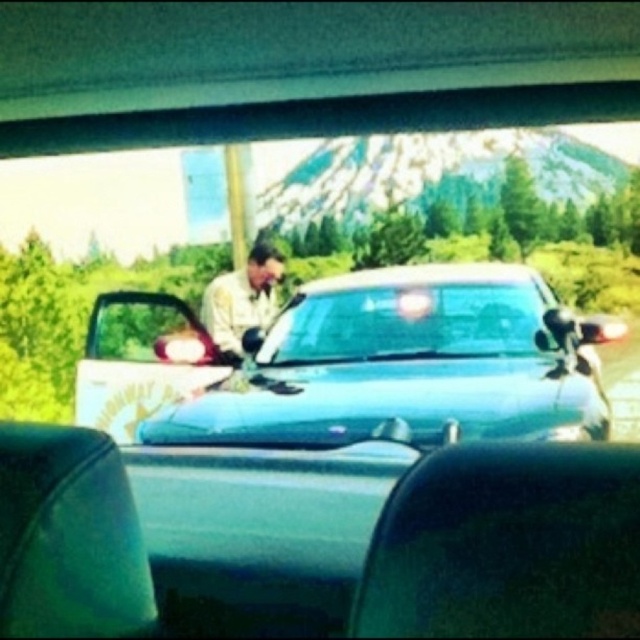
Between matte khaki uniform at center and light beige uniform at center, which one has less height?

Standing shorter between the two is light beige uniform at center.

Can you confirm if matte khaki uniform at center is positioned to the right of light beige uniform at center?

Yes, matte khaki uniform at center is to the right of light beige uniform at center.

This screenshot has width=640, height=640. In order to click on matte khaki uniform at center in this screenshot , I will do `click(404, 365)`.

What do you see at coordinates (404, 323) in the screenshot? The height and width of the screenshot is (640, 640). I see `transparent glass windshield at center` at bounding box center [404, 323].

Does transparent glass windshield at center have a greater height compared to light beige uniform at center?

In fact, transparent glass windshield at center may be shorter than light beige uniform at center.

Between point (256, 360) and point (216, 278), which one is positioned in front?

Point (256, 360) is in front.

Locate an element on the screen. The image size is (640, 640). transparent glass windshield at center is located at coordinates (404, 323).

Is matte khaki uniform at center to the right of transparent glass windshield at center from the viewer's perspective?

Incorrect, matte khaki uniform at center is not on the right side of transparent glass windshield at center.

Is point (513, 355) farther from camera compared to point (436, 333)?

No, (513, 355) is in front of (436, 333).

Locate an element on the screen. The image size is (640, 640). matte khaki uniform at center is located at coordinates (404, 365).